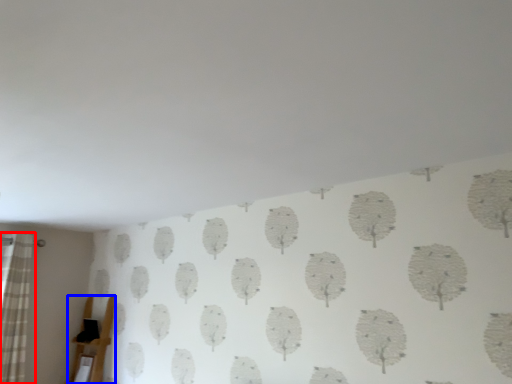
Question: Which point is further to the camera, curtain (highlighted by a red box) or furniture (highlighted by a blue box)?

Choices:
 (A) curtain
 (B) furniture

Answer: (B)